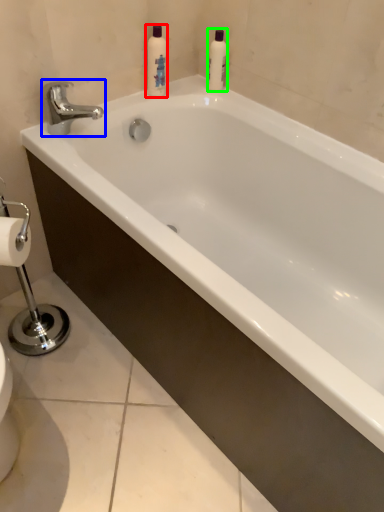
Question: Which object is the closest to the cleaning product (highlighted by a red box)? Choose among these: tap (highlighted by a blue box) or cleaning product (highlighted by a green box).

Choices:
 (A) tap
 (B) cleaning product

Answer: (B)